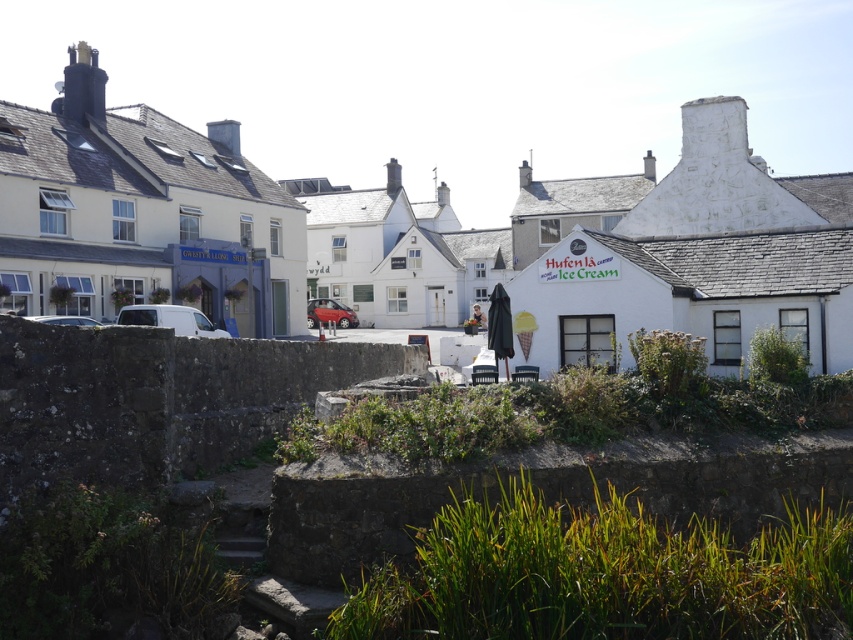
You are standing at the center of the image. Where is the white matte van at left located in relation to your position?

The white matte van at left is located to the left side of your position at point (170, 320).